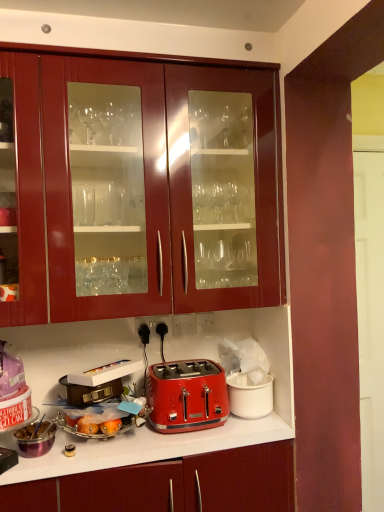
Question: From their relative heights in the image, would you say black plastic electrical outlet at lower center is taller or shorter than metallic silver toaster at lower left?

Choices:
 (A) short
 (B) tall

Answer: (B)

Question: Considering their positions, is black plastic electrical outlet at lower center located in front of or behind metallic silver toaster at lower left?

Choices:
 (A) front
 (B) behind

Answer: (B)

Question: Based on their relative distances, which object is nearer to the metallic silver toaster at lower left?

Choices:
 (A) red plastic toaster at center, the 3th appliance viewed from the left
 (B) metallic silver toaster at lower center
 (C) red metallic toaster at center
 (D) metallic silver bowl at lower left, the 1th appliance viewed from the left
 (E) matte red toaster at center

Answer: (D)

Question: Estimate the real-world distances between objects in this image. Which object is closer to the red plastic toaster at center, the 3th appliance viewed from the left?

Choices:
 (A) metallic silver bowl at lower left, the third appliance positioned from the right
 (B) metallic silver toaster at lower center
 (C) glossy wood cabinets at upper center
 (D) metallic silver toaster at lower left
 (E) matte red toaster at center

Answer: (E)